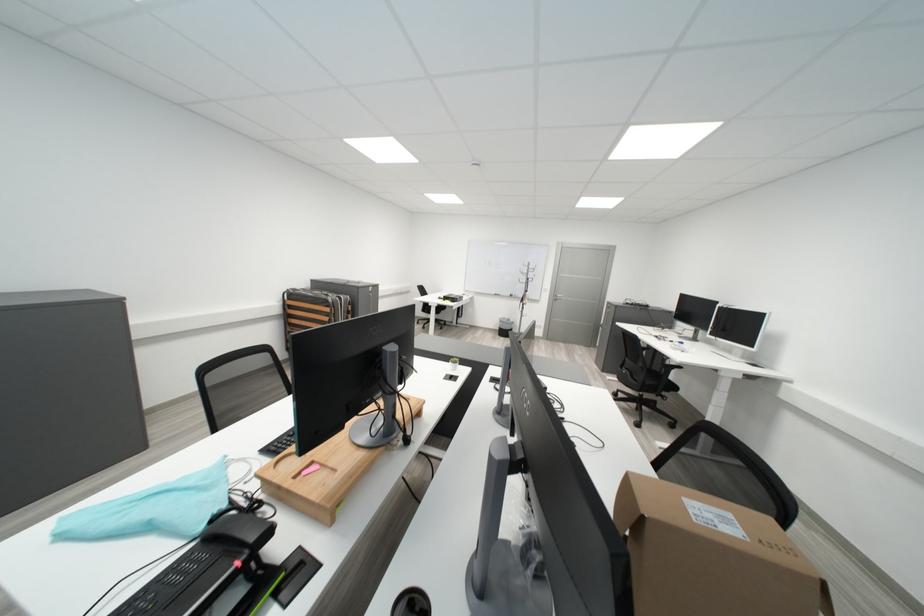
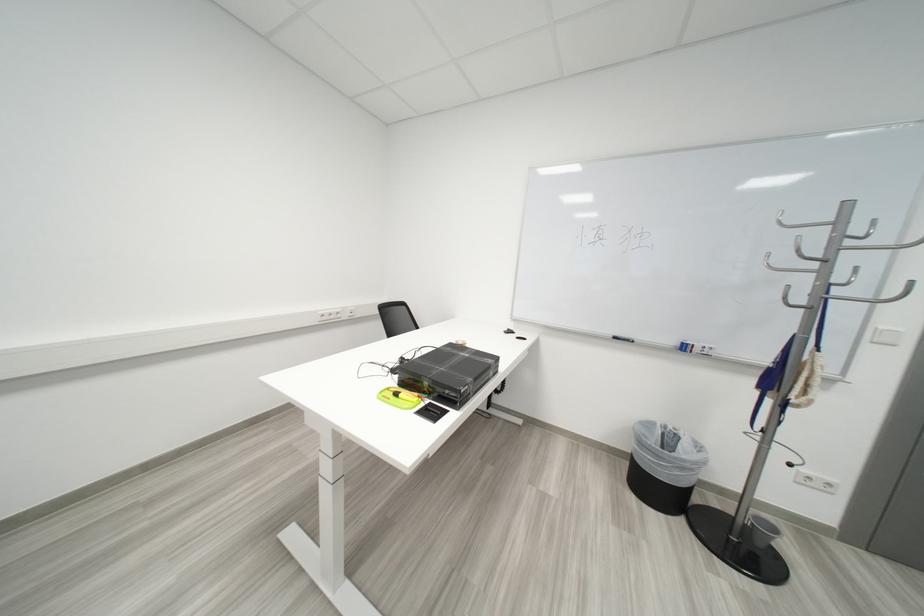
Locate, in the second image, the point that corresponds to point 541,270 in the first image.

(853, 238)